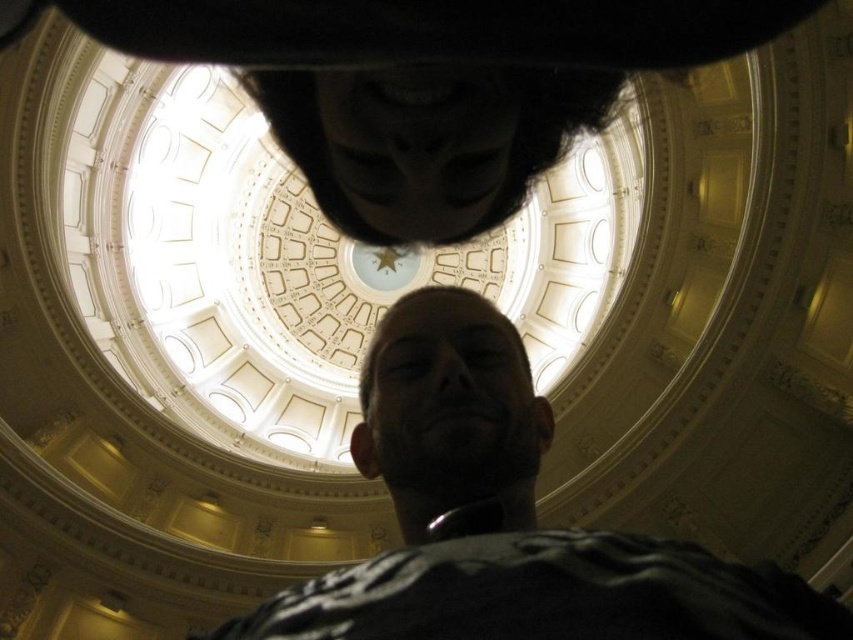
You are a security guard in the building and you notice two items in the image. One is the dark beard at center and the other is the black matte mask at upper center. Based on their sizes, which one could potentially cover more of a person face?

The dark beard at center might be wider than black matte mask at upper center, so it could potentially cover more of a person face.